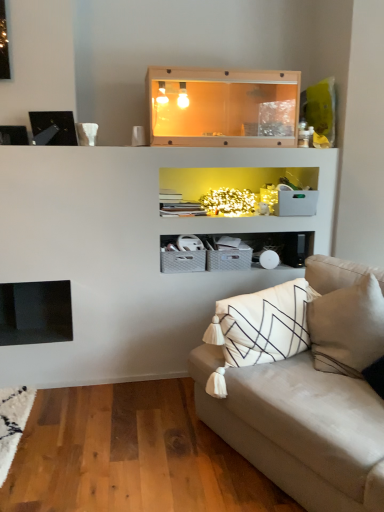
In order to face beige fabric couch at lower right, should I rotate leftwards or rightwards?

Turn right approximately 17.757 degrees to face it.

This screenshot has width=384, height=512. Describe the element at coordinates (309, 399) in the screenshot. I see `beige fabric couch at lower right` at that location.

Identify the location of beige fabric couch at lower right. The height and width of the screenshot is (512, 384). (309, 399).

The image size is (384, 512). I want to click on wooden tank at upper center, so click(222, 106).

What do you see at coordinates (222, 106) in the screenshot? The height and width of the screenshot is (512, 384). I see `wooden tank at upper center` at bounding box center [222, 106].

Measure the distance between point (292,123) and camera.

A distance of 2.58 meters exists between point (292,123) and camera.

You are a GUI agent. You are given a task and a screenshot of the screen. Output one action in this format:
    pyautogui.click(x=<x>, y=<y>)
    Task: Click on the beige fabric couch at lower right
    The height and width of the screenshot is (512, 384).
    Given the screenshot: What is the action you would take?
    pyautogui.click(x=309, y=399)

In the image, is wooden tank at upper center on the left side or the right side of beige fabric couch at lower right?

From the image, it's evident that wooden tank at upper center is to the left of beige fabric couch at lower right.

Between wooden tank at upper center and beige fabric couch at lower right, which one is positioned in front?

beige fabric couch at lower right is closer to the camera.

Which is behind, point (167, 97) or point (268, 362)?

The point (167, 97) is more distant.

From the image's perspective, is wooden tank at upper center on beige fabric couch at lower right?

Yes.

From a real-world perspective, between wooden tank at upper center and beige fabric couch at lower right, who is vertically lower?

beige fabric couch at lower right.

In the scene shown: Which object is wider, wooden tank at upper center or beige fabric couch at lower right?

Wider between the two is beige fabric couch at lower right.

Is wooden tank at upper center taller than beige fabric couch at lower right?

In fact, wooden tank at upper center may be shorter than beige fabric couch at lower right.

Considering the sizes of objects wooden tank at upper center and beige fabric couch at lower right in the image provided, who is bigger, wooden tank at upper center or beige fabric couch at lower right?

Bigger between the two is beige fabric couch at lower right.

Would you say wooden tank at upper center contains beige fabric couch at lower right?

No, beige fabric couch at lower right is located outside of wooden tank at upper center.

Is wooden tank at upper center in contact with beige fabric couch at lower right?

There is a gap between wooden tank at upper center and beige fabric couch at lower right.

Is wooden tank at upper center oriented away from beige fabric couch at lower right?

No, wooden tank at upper center is not facing away from beige fabric couch at lower right.

Consider the image. How different are the orientations of wooden tank at upper center and beige fabric couch at lower right in degrees?

There is a 67.1-degree angle between the facing directions of wooden tank at upper center and beige fabric couch at lower right.

Where is `studio couch that is on the right side of wooden tank at upper center`? This screenshot has height=512, width=384. studio couch that is on the right side of wooden tank at upper center is located at coordinates (309, 399).

Is beige fabric couch at lower right to the right of wooden tank at upper center from the viewer's perspective?

Correct, you'll find beige fabric couch at lower right to the right of wooden tank at upper center.

From the picture: Is beige fabric couch at lower right further to camera compared to wooden tank at upper center?

No, the depth of beige fabric couch at lower right is less than that of wooden tank at upper center.

Which is in front, point (377, 467) or point (218, 104)?

Positioned in front is point (377, 467).

From the image's perspective, is beige fabric couch at lower right located above wooden tank at upper center?

No, from the image's perspective, beige fabric couch at lower right is not on top of wooden tank at upper center.

From a real-world perspective, between beige fabric couch at lower right and wooden tank at upper center, who is vertically lower?

From a 3D spatial view, beige fabric couch at lower right is below.

In terms of width, does beige fabric couch at lower right look wider or thinner when compared to wooden tank at upper center?

Clearly, beige fabric couch at lower right has more width compared to wooden tank at upper center.

Can you confirm if beige fabric couch at lower right is taller than wooden tank at upper center?

Correct, beige fabric couch at lower right is much taller as wooden tank at upper center.

Considering the relative sizes of beige fabric couch at lower right and wooden tank at upper center in the image provided, is beige fabric couch at lower right smaller than wooden tank at upper center?

Incorrect, beige fabric couch at lower right is not smaller in size than wooden tank at upper center.

Would you say wooden tank at upper center is part of beige fabric couch at lower right's contents?

Definitely not — wooden tank at upper center is not inside beige fabric couch at lower right.

Is beige fabric couch at lower right directly adjacent to wooden tank at upper center?

beige fabric couch at lower right and wooden tank at upper center are clearly separated.

Is beige fabric couch at lower right looking in the opposite direction of wooden tank at upper center?

No.

Where is `shelf on the left of beige fabric couch at lower right`? The height and width of the screenshot is (512, 384). shelf on the left of beige fabric couch at lower right is located at coordinates (222, 106).

Locate an element on the screen. shelf above the beige fabric couch at lower right (from a real-world perspective) is located at coordinates (222, 106).

The width and height of the screenshot is (384, 512). Find the location of `studio couch below the wooden tank at upper center (from the image's perspective)`. studio couch below the wooden tank at upper center (from the image's perspective) is located at coordinates (309, 399).